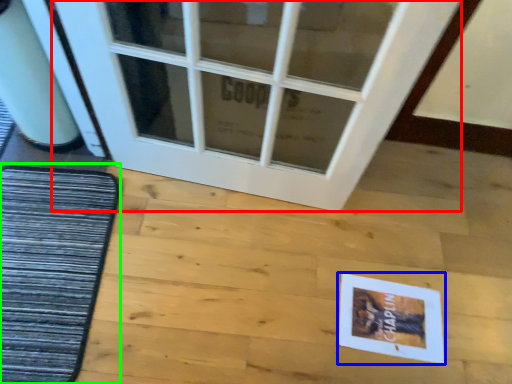
Question: Which object is the farthest from door (highlighted by a red box)? Choose among these: postcard (highlighted by a blue box) or mat (highlighted by a green box).

Choices:
 (A) postcard
 (B) mat

Answer: (A)